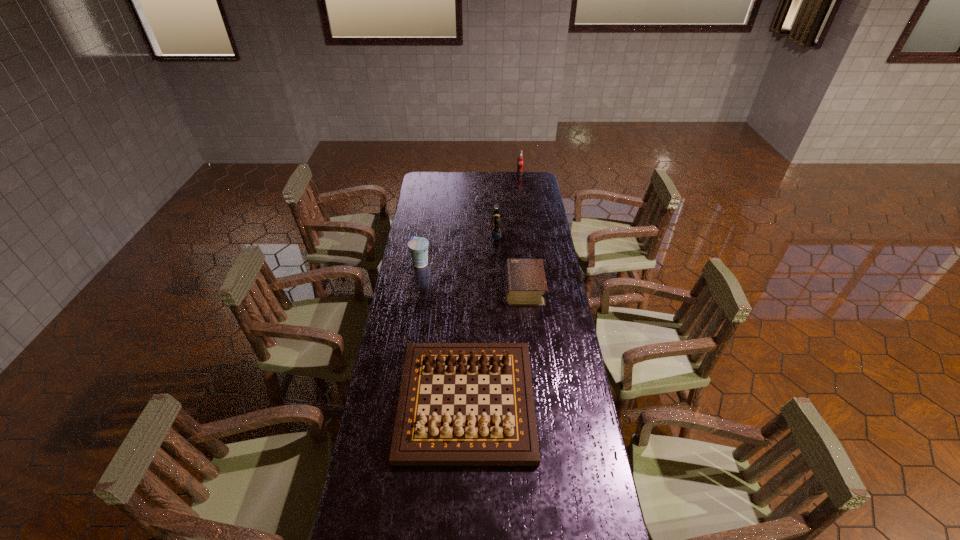
The image size is (960, 540). I want to click on vacant space in between the Bible and the soda bottle, so click(522, 231).

At what (x,y) coordinates should I click in order to perform the action: click on vacant region between the gameboard and the headset. Please return your answer as a coordinate pair (x, y). Looking at the image, I should click on (481, 317).

Point out which object is positioned as the third nearest to the soda bottle. Please provide its 2D coordinates. Your answer should be formatted as a tuple, i.e. [(x, y)], where the tuple contains the x and y coordinates of a point satisfying the conditions above.

[(418, 246)]

In order to click on object that ranks as the third closest to the fourth farthest object in this screenshot , I will do `click(418, 246)`.

I want to click on free region that satisfies the following two spatial constraints: 1. on the spine side of the second nearest object; 2. on the side with the white pieces of the nearest object, so click(537, 401).

Identify the location of vacant region that satisfies the following two spatial constraints: 1. on the label of the soda bottle; 2. on the ear cup of the fourth nearest object. The width and height of the screenshot is (960, 540). (528, 233).

At what (x,y) coordinates should I click in order to perform the action: click on vacant position in the image that satisfies the following two spatial constraints: 1. on the label of the soda bottle; 2. on the ear cup of the headset. Please return your answer as a coordinate pair (x, y). Looking at the image, I should click on (528, 233).

The image size is (960, 540). I want to click on blank area in the image that satisfies the following two spatial constraints: 1. on the spine side of the second nearest object; 2. on the side with the white pieces of the nearest object, so click(x=537, y=401).